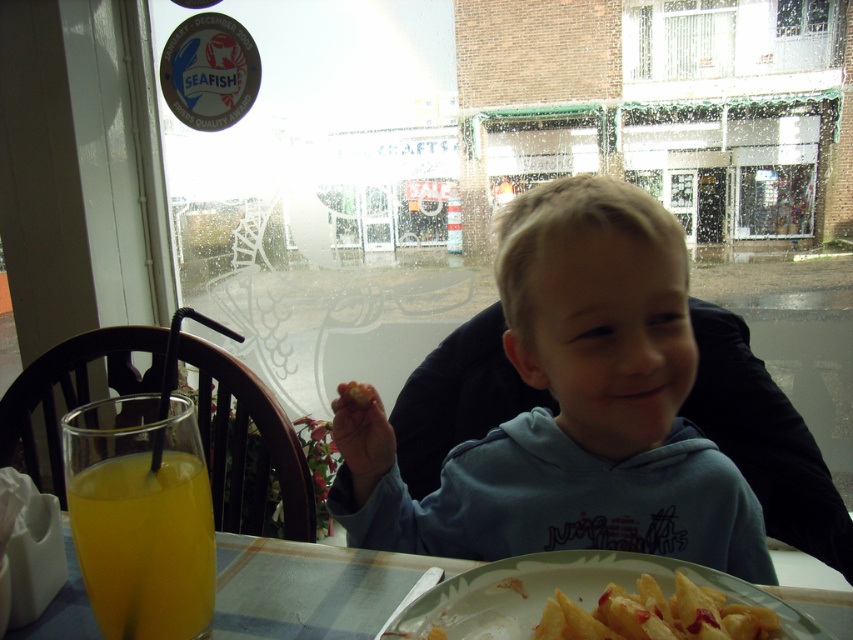
Does light blue hoodie at center lie in front of smooth orange carrot at center?

That is True.

Between point (741, 502) and point (354, 400), which one is positioned in front?

Point (354, 400) is more forward.

Which is behind, point (479, 508) or point (355, 400)?

Point (479, 508)

Identify the location of light blue hoodie at center. The image size is (853, 640). (572, 408).

Can you confirm if white ceramic plate at lower center is smaller than smooth orange carrot at center?

Incorrect, white ceramic plate at lower center is not smaller in size than smooth orange carrot at center.

Does white ceramic plate at lower center come behind smooth orange carrot at center?

No, white ceramic plate at lower center is in front of smooth orange carrot at center.

Is point (543, 598) positioned after point (366, 392)?

No, it is in front of (366, 392).

Locate an element on the screen. The image size is (853, 640). white ceramic plate at lower center is located at coordinates (581, 595).

Measure the distance between translucent orange juice at lower left and camera.

They are 19.33 inches apart.

Is translucent orange juice at lower left wider than white ceramic plate at lower center?

No, translucent orange juice at lower left is not wider than white ceramic plate at lower center.

Where is `translucent orange juice at lower left`? translucent orange juice at lower left is located at coordinates (144, 545).